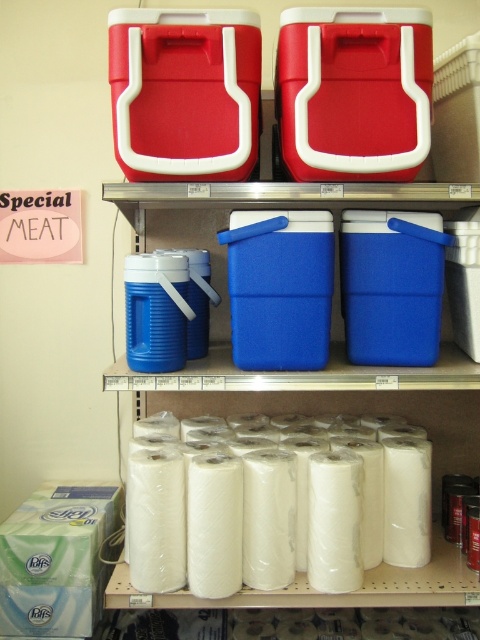
Which of these two, white matte toilet paper at lower center or blue plastic cooler at center, stands taller?

blue plastic cooler at center

Can you confirm if white matte toilet paper at lower center is positioned below blue plastic cooler at center?

Correct, white matte toilet paper at lower center is located below blue plastic cooler at center.

Which is in front, point (382, 468) or point (342, 196)?

Point (342, 196) is in front.

You are a GUI agent. You are given a task and a screenshot of the screen. Output one action in this format:
    pyautogui.click(x=<x>, y=<y>)
    Task: Click on the white matte toilet paper at lower center
    
    Given the screenshot: What is the action you would take?
    pyautogui.click(x=276, y=513)